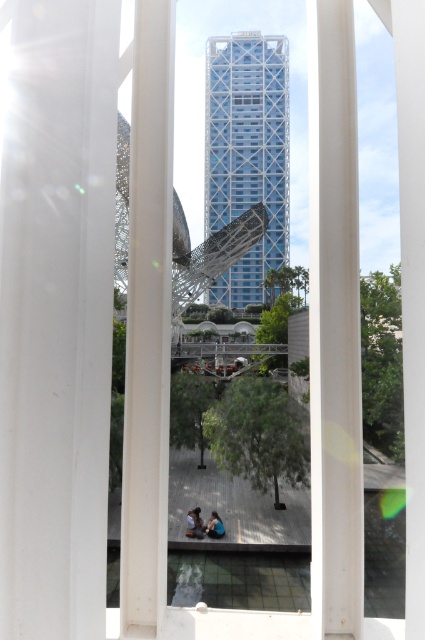
Question: Considering the real-world distances, which object is closest to the white smooth pillar at left?

Choices:
 (A) white matte pillar at center
 (B) blue fabric person at lower center
 (C) transparent glass tower at center
 (D) blue denim jeans at lower center

Answer: (A)

Question: Which object is positioned closest to the white matte pillar at center?

Choices:
 (A) blue denim jeans at lower center
 (B) blue fabric person at lower center

Answer: (A)

Question: Is white smooth pillar at left below blue denim jeans at lower center?

Choices:
 (A) no
 (B) yes

Answer: (A)

Question: Considering the real-world distances, which object is farthest from the blue denim jeans at lower center?

Choices:
 (A) blue fabric person at lower center
 (B) transparent glass tower at center
 (C) white smooth pillar at left

Answer: (B)

Question: Does transparent glass tower at center lie in front of blue denim jeans at lower center?

Choices:
 (A) no
 (B) yes

Answer: (A)

Question: Where is white matte pillar at center located in relation to blue denim jeans at lower center in the image?

Choices:
 (A) above
 (B) below

Answer: (A)